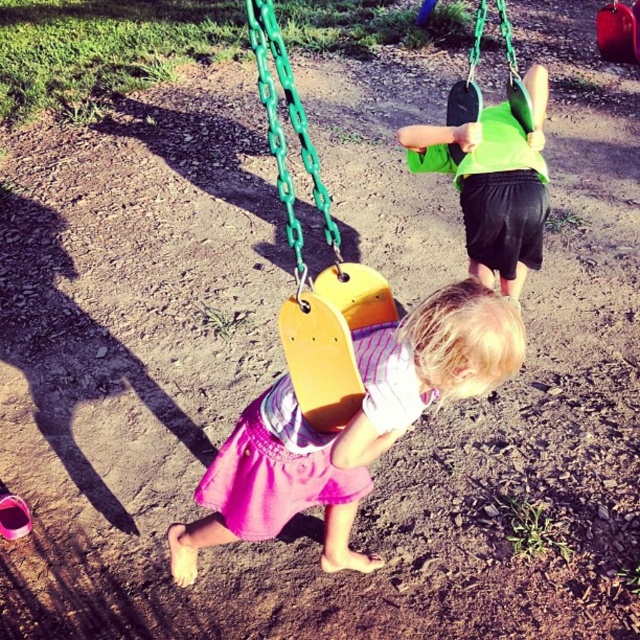
You are a photographer trying to capture a photo of the playground scene. You need to ensure that both the pink fabric skirt at center and the green matte swing at upper center are visible in your shot. Based on their positions, which object should you adjust your camera focus to first to include both in the frame?

The pink fabric skirt at center is to the left of the green matte swing at upper center, so you should adjust your camera focus to the pink fabric skirt at center first to ensure both are in the frame.

You are a parent at the playground and want to ensure that the pink fabric skirt at center does not get caught on the green matte swing at upper center. Based on their sizes, is there a risk of the skirt getting tangled?

The pink fabric skirt at center might be wider than green matte swing at upper center, so there is a possibility of the skirt getting tangled if it extends beyond the swing.

You are a photographer trying to capture the child in the pink fabric skirt at center and the green matte swing at upper center in a single shot. Since you want both subjects to be clearly visible, which one should you adjust your camera focus on first to ensure the larger subject is in focus?

The pink fabric skirt at center is larger in size than the green matte swing at upper center, so you should focus on the pink fabric skirt at center first to ensure it is in focus before adjusting for the smaller green matte swing at upper center.